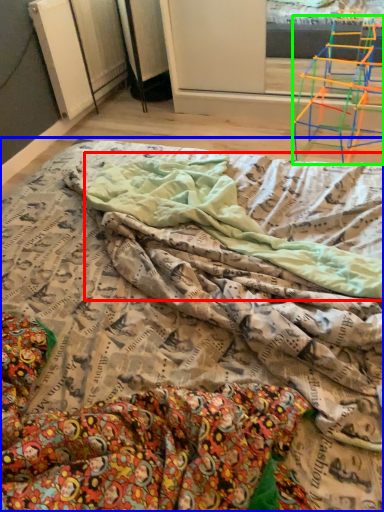
Question: Which object is positioned closest to blanket (highlighted by a red box)? Select from bed (highlighted by a blue box) and furniture (highlighted by a green box).

Choices:
 (A) bed
 (B) furniture

Answer: (A)